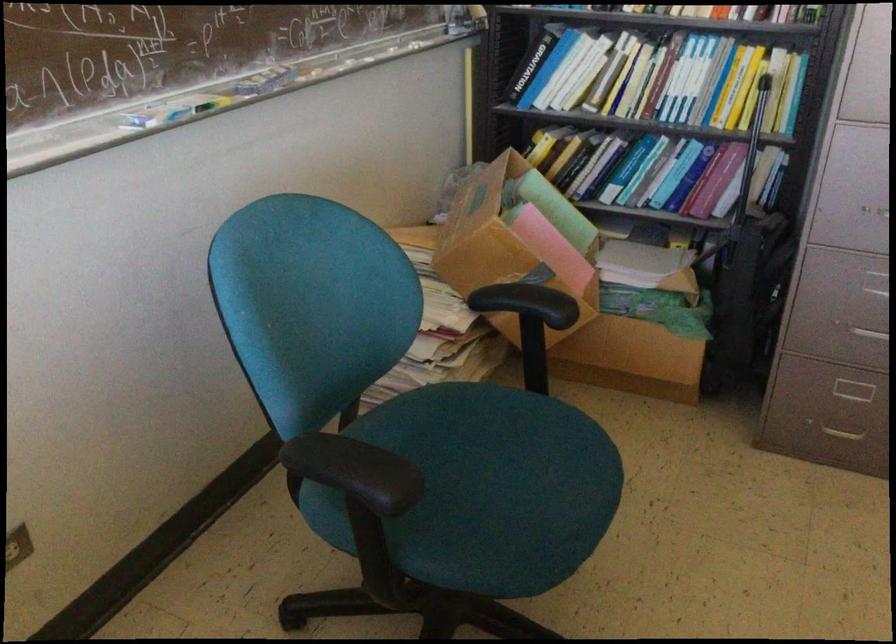
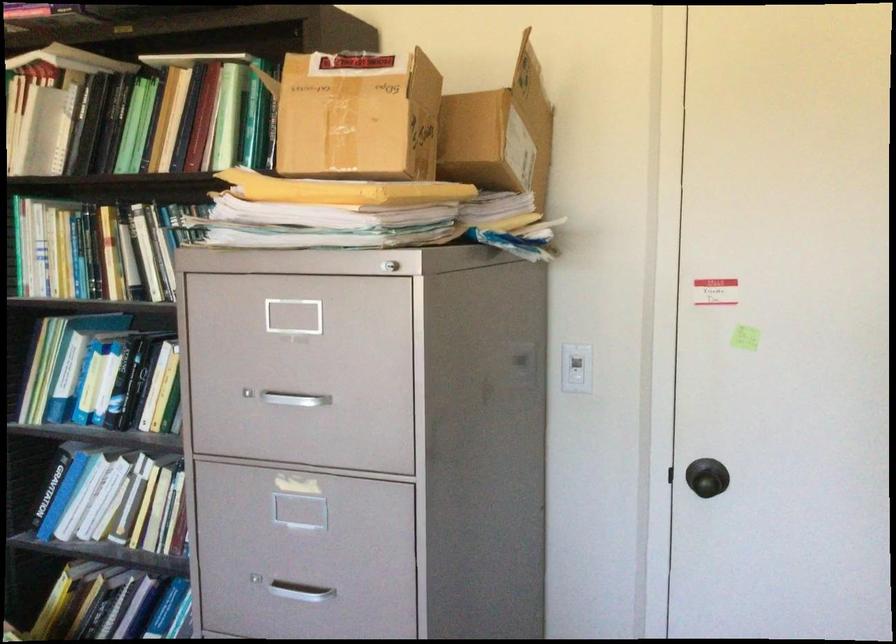
Question: I am providing you with two images of the same scene from different viewpoints. Which of the following objects are not visible in image2?

Choices:
 (A) cabinet drawer lock
 (B) red camera button
 (C) filing cabinet handle
 (D) yellow book

Answer: (D)